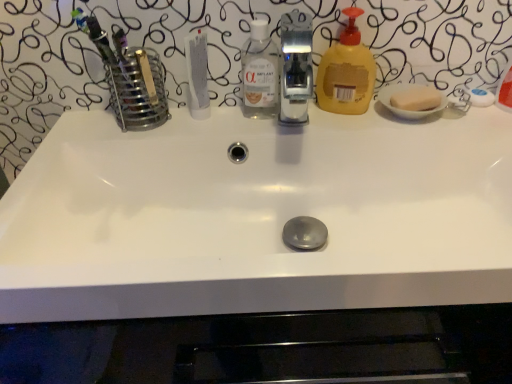
Question: Considering the relative positions of yellow translucent liquid soap at right and satin nickel faucet at center in the image provided, is yellow translucent liquid soap at right to the right of satin nickel faucet at center from the viewer's perspective?

Choices:
 (A) yes
 (B) no

Answer: (A)

Question: Would you say yellow translucent liquid soap at right is a long distance from satin nickel faucet at center?

Choices:
 (A) yes
 (B) no

Answer: (A)

Question: Is yellow translucent liquid soap at right positioned before satin nickel faucet at center?

Choices:
 (A) yes
 (B) no

Answer: (B)

Question: From the image's perspective, is yellow translucent liquid soap at right above satin nickel faucet at center?

Choices:
 (A) no
 (B) yes

Answer: (B)

Question: Is yellow translucent liquid soap at right bigger than satin nickel faucet at center?

Choices:
 (A) no
 (B) yes

Answer: (A)

Question: From a real-world perspective, relative to satin nickel faucet at center, is transparent plastic bottle at center vertically above or below?

Choices:
 (A) above
 (B) below

Answer: (B)

Question: Would you say transparent plastic bottle at center is to the left or to the right of satin nickel faucet at center in the picture?

Choices:
 (A) left
 (B) right

Answer: (A)

Question: Is transparent plastic bottle at center inside or outside of satin nickel faucet at center?

Choices:
 (A) inside
 (B) outside

Answer: (B)

Question: Is transparent plastic bottle at center wider or thinner than satin nickel faucet at center?

Choices:
 (A) wide
 (B) thin

Answer: (B)

Question: Relative to transparent plastic bottle at center, is yellow translucent liquid soap at right in front or behind?

Choices:
 (A) behind
 (B) front

Answer: (A)

Question: Does point (361, 81) appear closer or farther from the camera than point (248, 39)?

Choices:
 (A) closer
 (B) farther

Answer: (A)

Question: Is yellow translucent liquid soap at right inside or outside of transparent plastic bottle at center?

Choices:
 (A) inside
 (B) outside

Answer: (B)

Question: From the image's perspective, is yellow translucent liquid soap at right located above or below transparent plastic bottle at center?

Choices:
 (A) below
 (B) above

Answer: (B)

Question: Is satin nickel faucet at center to the left or to the right of white matte tube at center in the image?

Choices:
 (A) left
 (B) right

Answer: (B)

Question: In the image, is satin nickel faucet at center positioned in front of or behind white matte tube at center?

Choices:
 (A) behind
 (B) front

Answer: (B)